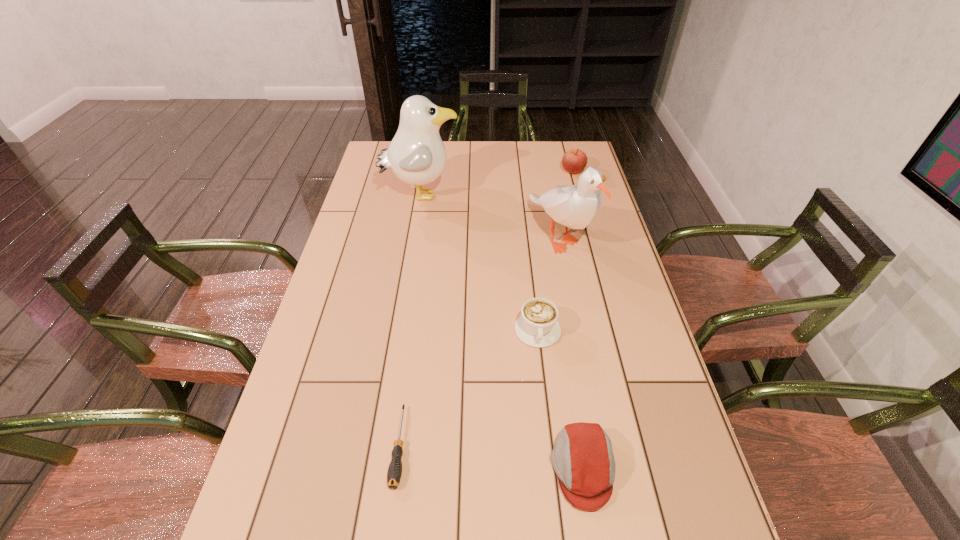
Locate an element on the screen. The height and width of the screenshot is (540, 960). free space between the cap and the apple is located at coordinates (578, 320).

Locate an element on the screen. This screenshot has width=960, height=540. vacant space that is in between the left gull and the apple is located at coordinates (496, 183).

Where is `empty space that is in between the fifth shortest object and the left gull`? The image size is (960, 540). empty space that is in between the fifth shortest object and the left gull is located at coordinates (491, 216).

Where is `vacant area between the screwdriver and the cap`? vacant area between the screwdriver and the cap is located at coordinates (491, 457).

Find the location of `free space between the cappuccino and the screwdriver`. free space between the cappuccino and the screwdriver is located at coordinates 468,389.

Identify which object is located as the fourth nearest to the left gull. Please provide its 2D coordinates. Your answer should be formatted as a tuple, i.e. [(x, y)], where the tuple contains the x and y coordinates of a point satisfying the conditions above.

[(394, 473)]

This screenshot has width=960, height=540. Identify the location of object that ranks as the closest to the cap. (537, 326).

Where is `free spot that satisfies the following two spatial constraints: 1. on the beak of the left gull; 2. on the left side of the shortest object`? Image resolution: width=960 pixels, height=540 pixels. free spot that satisfies the following two spatial constraints: 1. on the beak of the left gull; 2. on the left side of the shortest object is located at coordinates (379, 447).

Find the location of a particular element. This screenshot has height=540, width=960. free space that satisfies the following two spatial constraints: 1. on the front side of the apple; 2. on the front-facing side of the cap is located at coordinates [x=655, y=468].